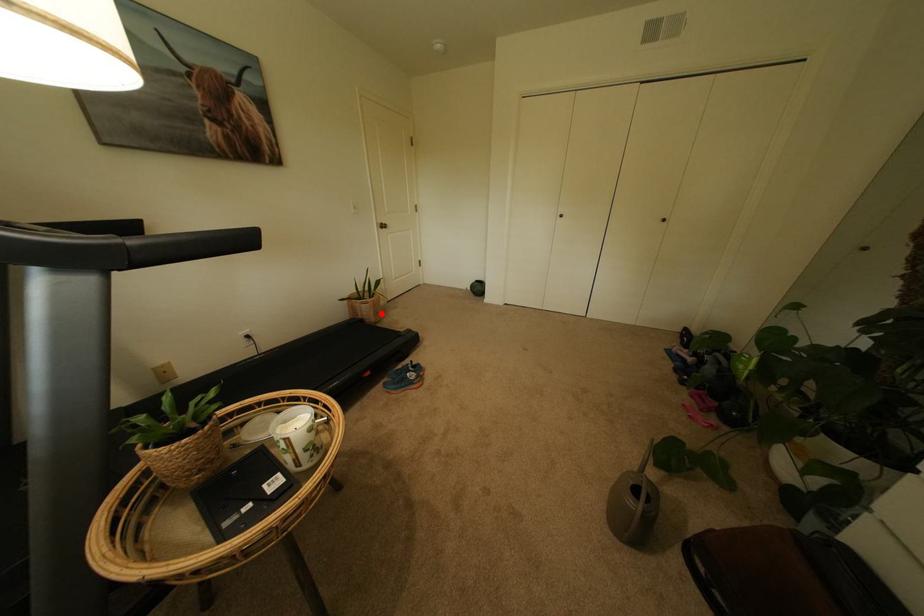
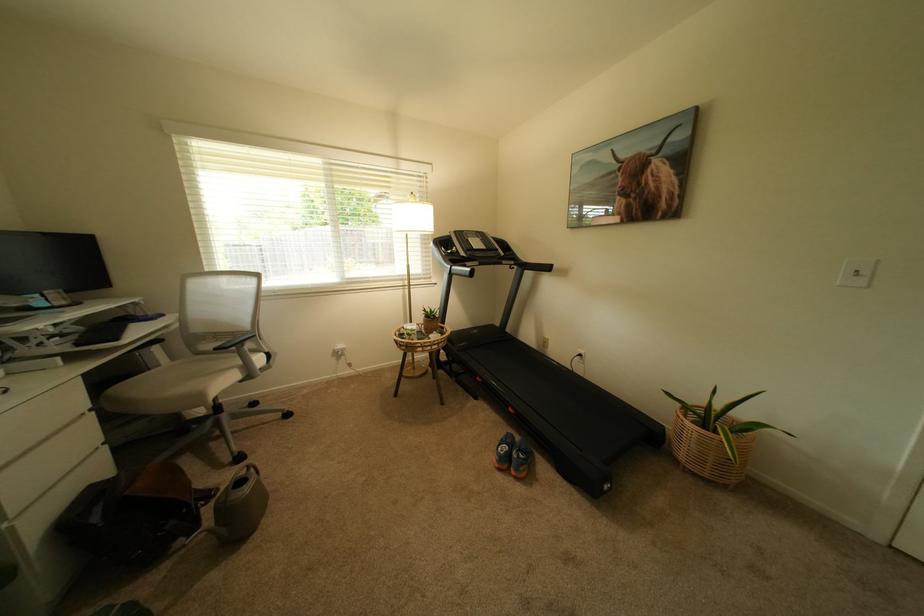
Question: I am providing you with two images of the same scene from different viewpoints. A red point is shown in image1. For the corresponding object point in image2, is it positioned nearer or farther from the camera?

Choices:
 (A) Nearer
 (B) Farther

Answer: (B)